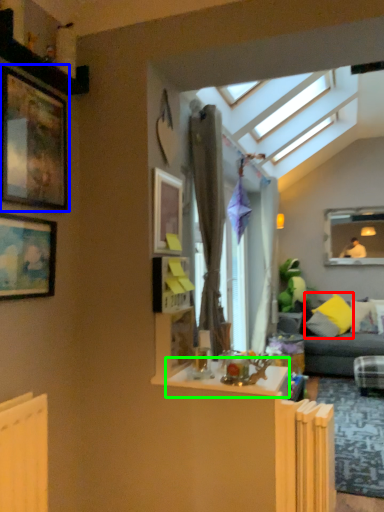
Question: Which object is the closest to the pillow (highlighted by a red box)? Choose among these: picture frame (highlighted by a blue box) or table (highlighted by a green box).

Choices:
 (A) picture frame
 (B) table

Answer: (B)